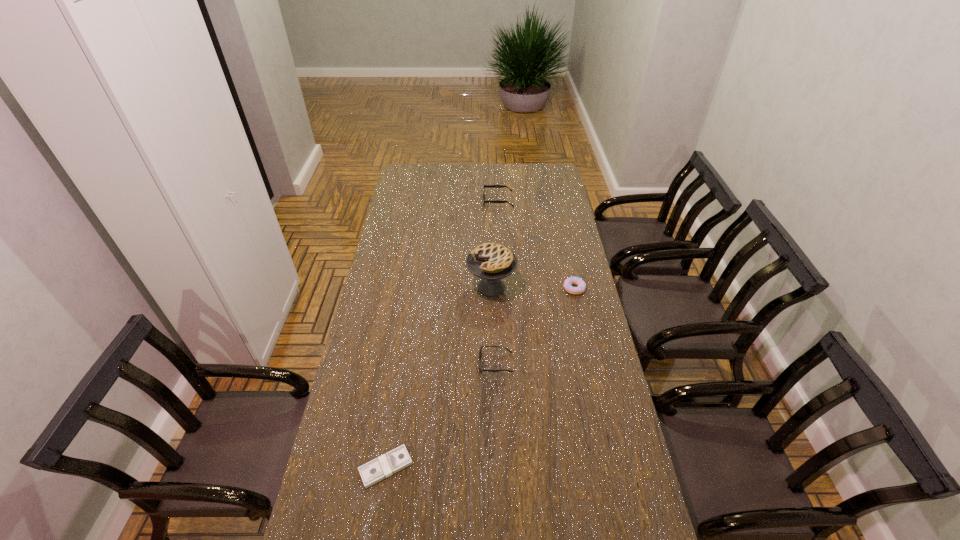
You are a GUI agent. You are given a task and a screenshot of the screen. Output one action in this format:
    pyautogui.click(x=<x>, y=<y>)
    Task: Click on the tallest object
    This screenshot has width=960, height=540.
    Given the screenshot: What is the action you would take?
    pyautogui.click(x=491, y=262)

This screenshot has width=960, height=540. What are the coordinates of `the fourth shortest object` in the screenshot? It's located at (485, 186).

The height and width of the screenshot is (540, 960). I want to click on the farthest object, so click(485, 186).

Where is `doughnut`? This screenshot has height=540, width=960. doughnut is located at coordinates (569, 281).

Locate an element on the screen. the shorter sunglasses is located at coordinates (480, 351).

Locate an element on the screen. the nearer sunglasses is located at coordinates (480, 351).

At what (x,y) coordinates should I click in order to perform the action: click on the shortest object. Please return your answer as a coordinate pair (x, y). This screenshot has width=960, height=540. Looking at the image, I should click on (397, 459).

Locate an element on the screen. the nearest object is located at coordinates (397, 459).

In order to click on free space located 0.160m on the cut side of the tallest object in this screenshot , I will do `click(427, 287)`.

This screenshot has width=960, height=540. Find the location of `vacant space located on the cut side of the tallest object`. vacant space located on the cut side of the tallest object is located at coordinates (422, 287).